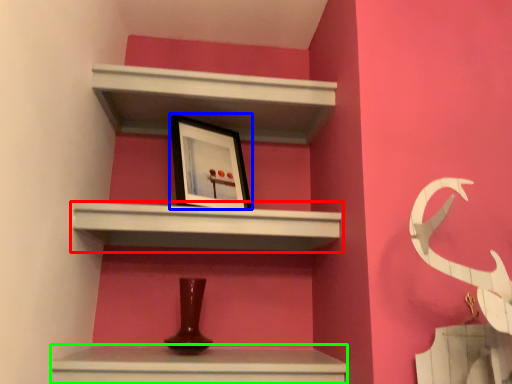
Question: Estimate the real-world distances between objects in this image. Which object is closer to shelf (highlighted by a red box), picture frame (highlighted by a blue box) or vanity (highlighted by a green box)?

Choices:
 (A) picture frame
 (B) vanity

Answer: (A)